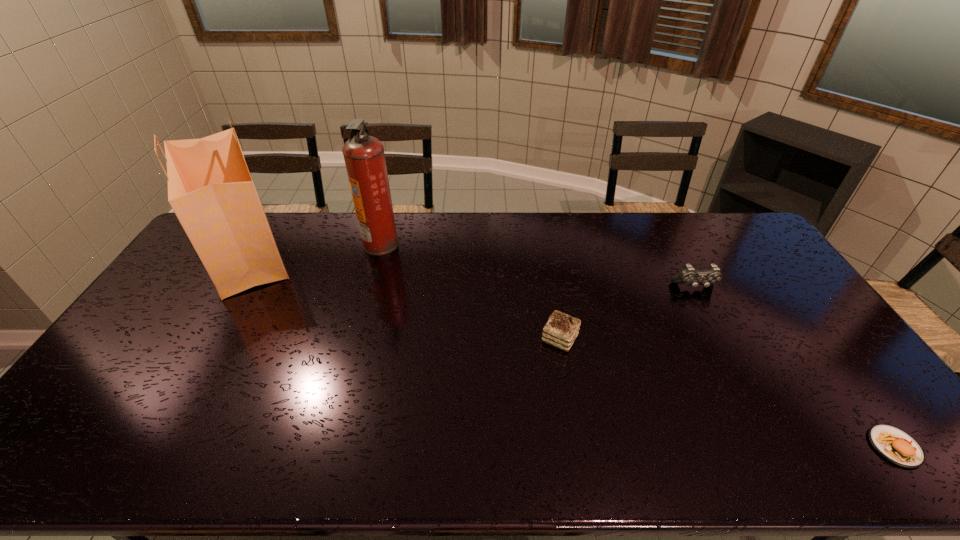
Locate an element on the screen. free spot between the rightmost object and the grocery bag is located at coordinates (571, 351).

Where is `vacant area that lies between the rightmost object and the fire extinguisher`? The image size is (960, 540). vacant area that lies between the rightmost object and the fire extinguisher is located at coordinates (637, 345).

Find the location of `empty space that is in between the grocery bag and the shortest object`. empty space that is in between the grocery bag and the shortest object is located at coordinates (571, 351).

You are a GUI agent. You are given a task and a screenshot of the screen. Output one action in this format:
    pyautogui.click(x=<x>, y=<y>)
    Task: Click on the free spot between the control and the fourth tallest object
    
    Given the screenshot: What is the action you would take?
    pyautogui.click(x=627, y=313)

Point out which object is positioned as the third nearest to the shortest object. Please provide its 2D coordinates. Your answer should be formatted as a tuple, i.e. [(x, y)], where the tuple contains the x and y coordinates of a point satisfying the conditions above.

[(364, 156)]

Identify which object is located as the fourth nearest to the fire extinguisher. Please provide its 2D coordinates. Your answer should be formatted as a tuple, i.e. [(x, y)], where the tuple contains the x and y coordinates of a point satisfying the conditions above.

[(898, 447)]

Find the location of a particular element. vacant region that satisfies the following two spatial constraints: 1. on the back side of the rightmost object; 2. at the nozzle of the fire extinguisher is located at coordinates (747, 244).

Where is `free space that satisfies the following two spatial constraints: 1. at the nozzle of the patty; 2. on the left side of the second object from left to right`? free space that satisfies the following two spatial constraints: 1. at the nozzle of the patty; 2. on the left side of the second object from left to right is located at coordinates (325, 447).

Find the location of `free space that satisfies the following two spatial constraints: 1. on the side of the grocery bag with the superhero design; 2. on the back side of the third object from left to right`. free space that satisfies the following two spatial constraints: 1. on the side of the grocery bag with the superhero design; 2. on the back side of the third object from left to right is located at coordinates (196, 339).

The width and height of the screenshot is (960, 540). I want to click on vacant area in the image that satisfies the following two spatial constraints: 1. at the nozzle of the third object from right to left; 2. on the right side of the fire extinguisher, so click(355, 339).